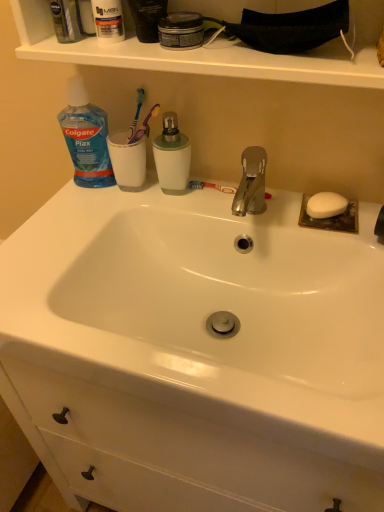
The width and height of the screenshot is (384, 512). What are the coordinates of `vacant area that is in front of green matte mouthwash at center, which appears as the second mouthwash when viewed from the left` in the screenshot? It's located at (165, 214).